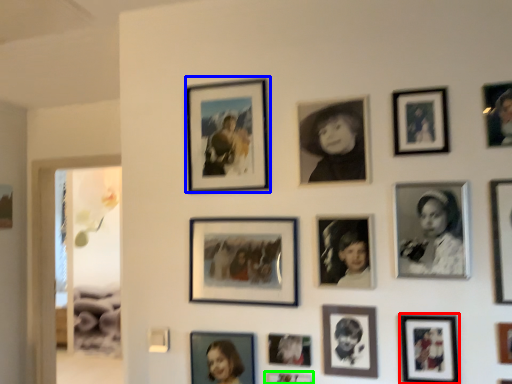
Question: Which object is the farthest from picture frame (highlighted by a red box)? Choose among these: picture frame (highlighted by a blue box) or picture frame (highlighted by a green box).

Choices:
 (A) picture frame
 (B) picture frame

Answer: (A)